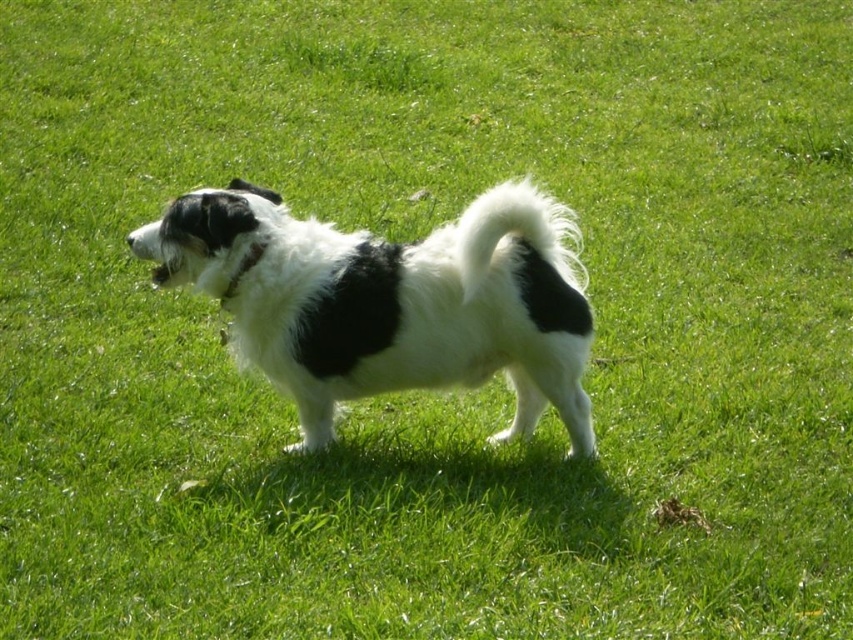
Is point (515, 182) closer to viewer compared to point (251, 266)?

No, it is not.

Does black-and-white fur dog at center appear on the left side of black fabric neckband at center?

In fact, black-and-white fur dog at center is to the right of black fabric neckband at center.

Between point (500, 189) and point (265, 237), which one is positioned behind?

Positioned behind is point (500, 189).

The width and height of the screenshot is (853, 640). What are the coordinates of `black-and-white fur dog at center` in the screenshot? It's located at (392, 301).

Does black-and-white fur dog at center appear on the right side of white fluffy tail at center?

Incorrect, black-and-white fur dog at center is not on the right side of white fluffy tail at center.

Is point (328, 333) farther from camera compared to point (515, 224)?

Yes.

The image size is (853, 640). I want to click on black-and-white fur dog at center, so click(392, 301).

Does white fluffy tail at center lie behind black fabric neckband at center?

Yes, white fluffy tail at center is behind black fabric neckband at center.

Is point (547, 198) closer to camera compared to point (236, 276)?

That is False.

The width and height of the screenshot is (853, 640). I want to click on white fluffy tail at center, so click(x=515, y=232).